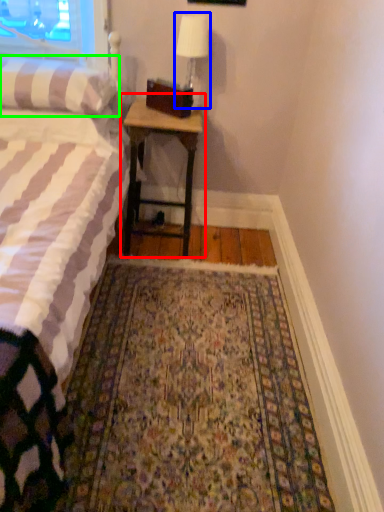
Question: Which object is positioned farthest from nightstand (highlighted by a red box)? Select from bedside lamp (highlighted by a blue box) and pillow (highlighted by a green box).

Choices:
 (A) bedside lamp
 (B) pillow

Answer: (A)